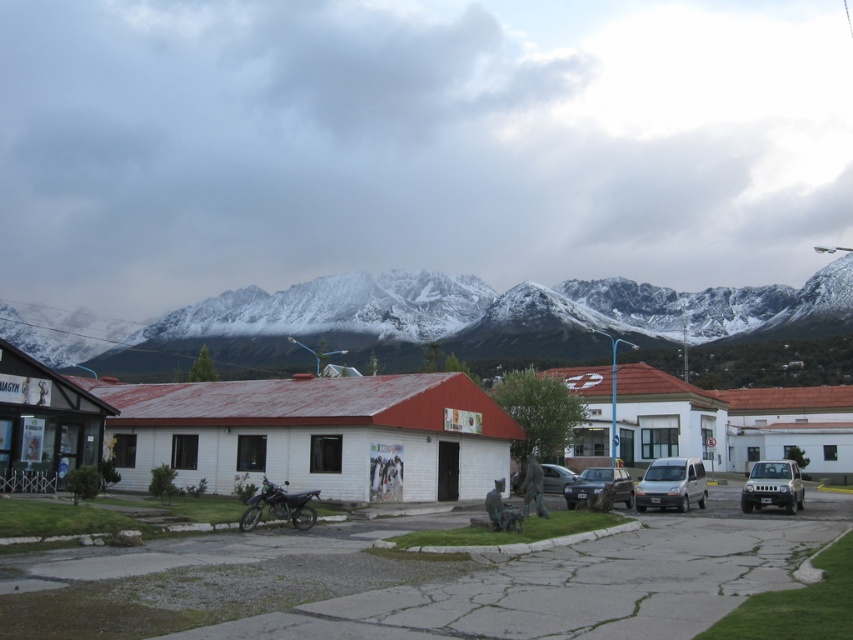
Between point (666, 480) and point (573, 499), which one is positioned behind?

Positioned behind is point (573, 499).

Who is taller, silver metallic van at center or metallic silver car at center?

silver metallic van at center

Does point (650, 490) come behind point (624, 497)?

No.

This screenshot has height=640, width=853. I want to click on silver metallic van at center, so click(x=672, y=484).

Is metallic silver car at center in front of matte gray car at center?

Yes, metallic silver car at center is closer to the viewer.

Between metallic silver car at center and matte gray car at center, which one has less height?

matte gray car at center is shorter.

Who is more forward, (614, 484) or (560, 468)?

Point (614, 484) is in front.

The width and height of the screenshot is (853, 640). I want to click on metallic silver car at center, so click(599, 486).

Is point (677, 474) less distant than point (573, 472)?

Yes, point (677, 474) is in front of point (573, 472).

Can you confirm if silver metallic van at center is bigger than matte gray car at center?

Yes.

The width and height of the screenshot is (853, 640). Find the location of `silver metallic van at center`. silver metallic van at center is located at coordinates (672, 484).